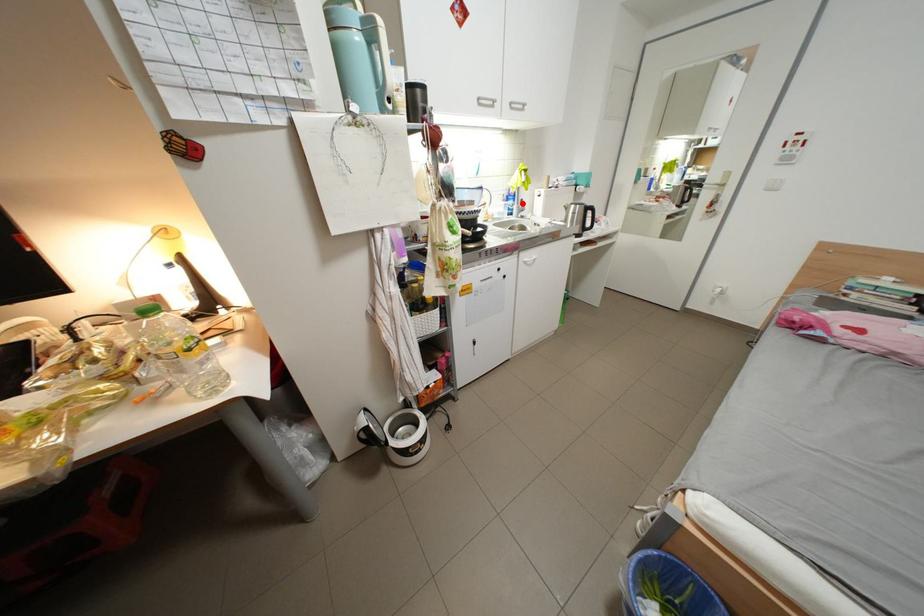
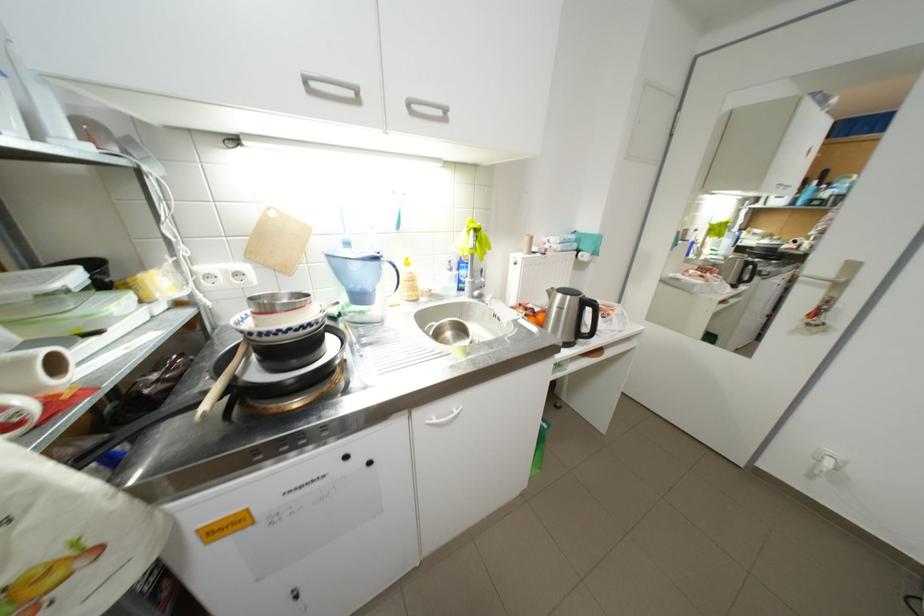
Question: I am providing you with two images of the same scene from different viewpoints. A red point is shown in image1. For the corresponding object point in image2, is it positioned nearer or farther from the camera?

Choices:
 (A) Nearer
 (B) Farther

Answer: (B)